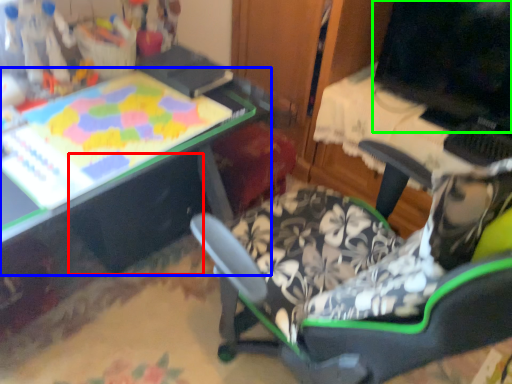
Question: Considering the real-world distances, which object is closest to drawer (highlighted by a red box)? table (highlighted by a blue box) or computer monitor (highlighted by a green box).

Choices:
 (A) table
 (B) computer monitor

Answer: (A)